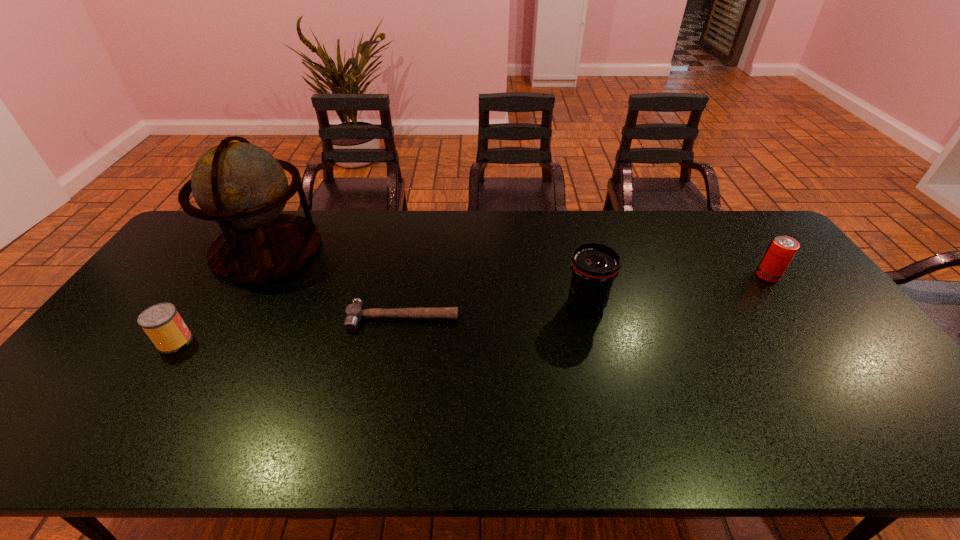
You are a GUI agent. You are given a task and a screenshot of the screen. Output one action in this format:
    pyautogui.click(x=<x>, y=<y>)
    Task: Click on the vacant region located 0.360m on the back of the fourth shortest object
    This screenshot has width=960, height=540.
    Given the screenshot: What is the action you would take?
    pyautogui.click(x=565, y=221)

Locate an element on the screen. The height and width of the screenshot is (540, 960). free space located on the front of the taller can is located at coordinates (852, 393).

Where is `vacant region located on the back of the shorter can`? Image resolution: width=960 pixels, height=540 pixels. vacant region located on the back of the shorter can is located at coordinates (215, 280).

The height and width of the screenshot is (540, 960). What are the coordinates of `free location located on the striking face of the hammer` in the screenshot? It's located at (389, 396).

At what (x,y) coordinates should I click in order to perform the action: click on object that is at the far edge. Please return your answer as a coordinate pair (x, y). Looking at the image, I should click on (242, 187).

You are a GUI agent. You are given a task and a screenshot of the screen. Output one action in this format:
    pyautogui.click(x=<x>, y=<y>)
    Task: Click on the globe that is at the left edge
    
    Given the screenshot: What is the action you would take?
    pyautogui.click(x=242, y=187)

The width and height of the screenshot is (960, 540). Find the location of `can that is at the left edge`. can that is at the left edge is located at coordinates tap(162, 323).

Image resolution: width=960 pixels, height=540 pixels. Identify the location of object that is positioned at the right edge. (781, 250).

This screenshot has width=960, height=540. In order to click on object positioned at the far left corner in this screenshot , I will do `click(242, 187)`.

Locate an element on the screen. The width and height of the screenshot is (960, 540). vacant space at the far edge is located at coordinates (542, 222).